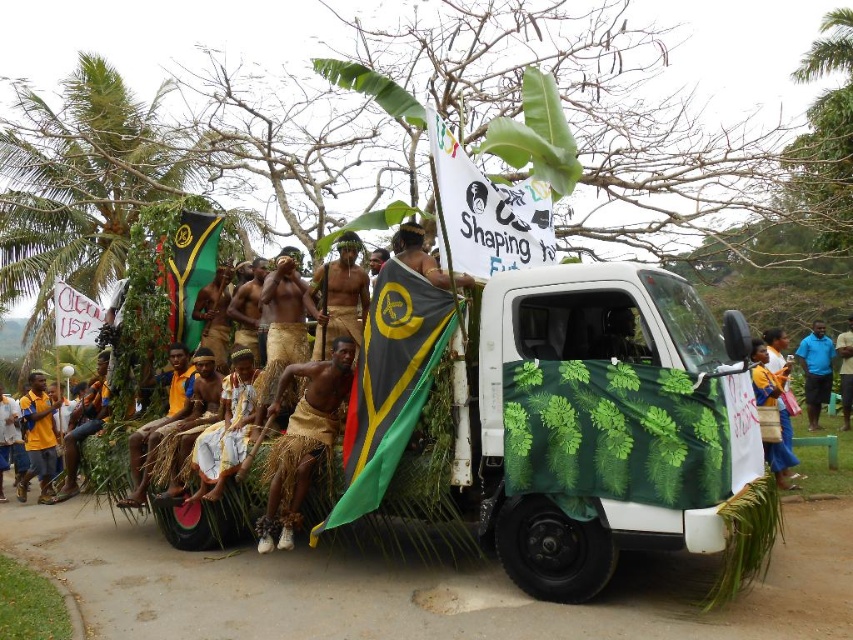
Question: In this image, where is green fabric flag at left located relative to matte yellow flag at center?

Choices:
 (A) right
 (B) left

Answer: (B)

Question: From the image, what is the correct spatial relationship of green fabric flag at left in relation to blue shirt at center?

Choices:
 (A) above
 (B) below

Answer: (A)

Question: Which point is farther to the camera?

Choices:
 (A) white fabric at center
 (B) green leafy banana tree at left
 (C) tan woven skirt at center
 (D) brown textured skin at center

Answer: (B)

Question: Which of these objects is positioned closest to the white paper banner at upper center?

Choices:
 (A) green leafy banana tree at left
 (B) blue shirt at center
 (C) brown woven grass skirt at center

Answer: (C)

Question: Can you confirm if green leafy banana tree at left is positioned to the right of white paper banner at upper center?

Choices:
 (A) no
 (B) yes

Answer: (A)

Question: Which point is farther to the camera?

Choices:
 (A) pos(769,385)
 (B) pos(38,269)

Answer: (B)